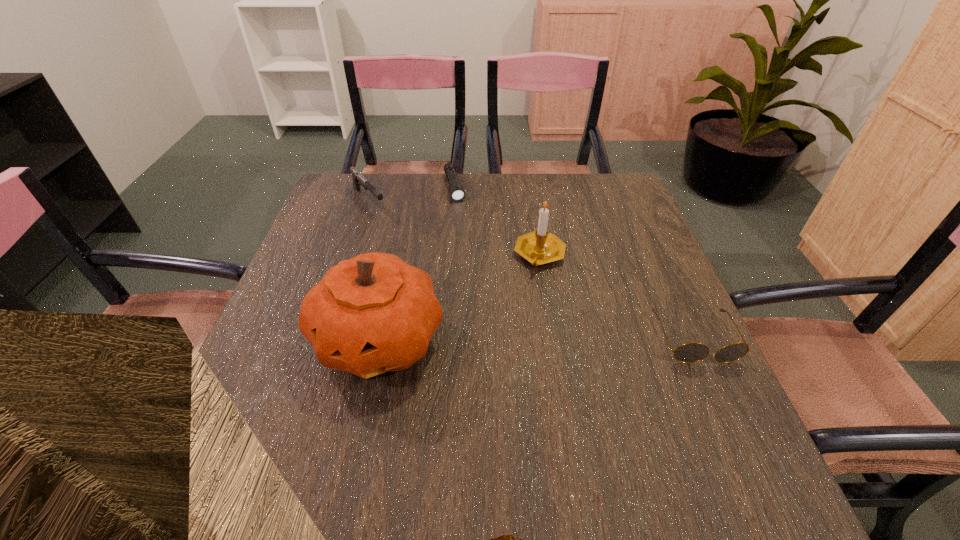
The width and height of the screenshot is (960, 540). I want to click on free location at the far right corner, so click(x=601, y=184).

Locate an element on the screen. The height and width of the screenshot is (540, 960). free space between the third shortest object and the shortest object is located at coordinates (412, 194).

Find the location of a particular element. free spot between the pumpkin and the shortest object is located at coordinates (417, 263).

The height and width of the screenshot is (540, 960). Identify the location of empty space that is in between the third shortest object and the second object from right to left. (454, 228).

Identify the location of vacant space that's between the gun and the flashlight. (412, 194).

The width and height of the screenshot is (960, 540). I want to click on vacant area that lies between the candle holder and the shortest object, so click(x=497, y=221).

Where is `empty space that is in between the second tallest object and the pumpkin`? empty space that is in between the second tallest object and the pumpkin is located at coordinates (460, 296).

This screenshot has height=540, width=960. Identify the location of free space that is in between the shortest object and the fourth object from left to right. (497, 221).

Image resolution: width=960 pixels, height=540 pixels. I want to click on free space between the fourth object from left to right and the shortest object, so click(497, 221).

Find the location of a particular element. object that is the third nearest to the shortest object is located at coordinates (374, 313).